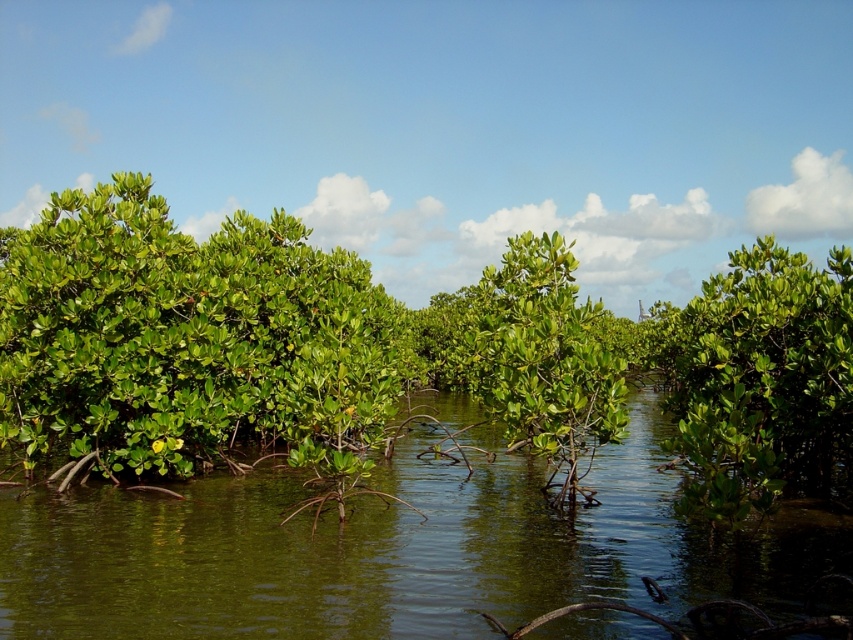
Question: Which point is closer to the camera?

Choices:
 (A) green leafy bush at left
 (B) green leafy plant at center
 (C) green leafy mangrove at center

Answer: (B)

Question: Is green leafy bush at left to the left of green leafy plant at center from the viewer's perspective?

Choices:
 (A) yes
 (B) no

Answer: (A)

Question: Which of these objects is positioned closest to the green leafy mangrove at center?

Choices:
 (A) green leafy plant at center
 (B) green leafy bush at left

Answer: (A)

Question: Considering the real-world distances, which object is farthest from the green leafy mangrove at center?

Choices:
 (A) green leafy plant at center
 (B) green leafy vegetation at center

Answer: (B)

Question: In this image, where is green leafy mangrove at center located relative to green leafy vegetation at center?

Choices:
 (A) above
 (B) below

Answer: (A)

Question: Considering the relative positions of green leafy mangrove at center and green leafy vegetation at center in the image provided, where is green leafy mangrove at center located with respect to green leafy vegetation at center?

Choices:
 (A) above
 (B) below

Answer: (A)